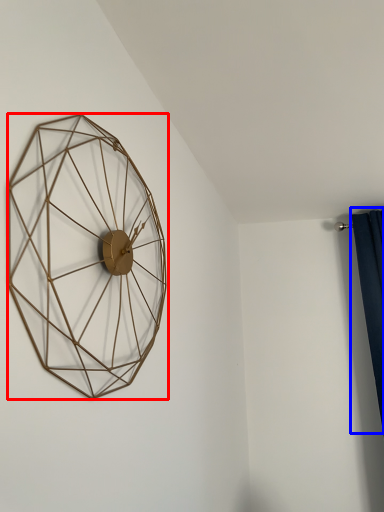
Question: Among these objects, which one is farthest to the camera, wall clock (highlighted by a red box) or curtain (highlighted by a blue box)?

Choices:
 (A) wall clock
 (B) curtain

Answer: (B)